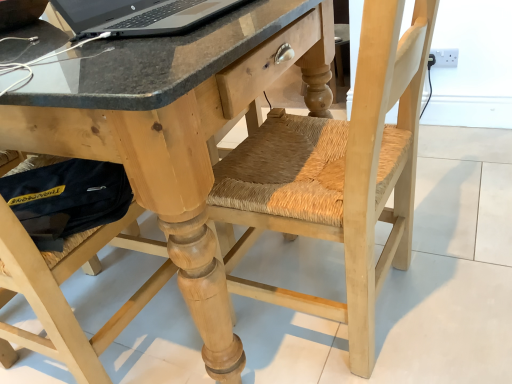
Image resolution: width=512 pixels, height=384 pixels. Find the location of `free spot in front of silver metallic laptop at upper left`. free spot in front of silver metallic laptop at upper left is located at coordinates (165, 50).